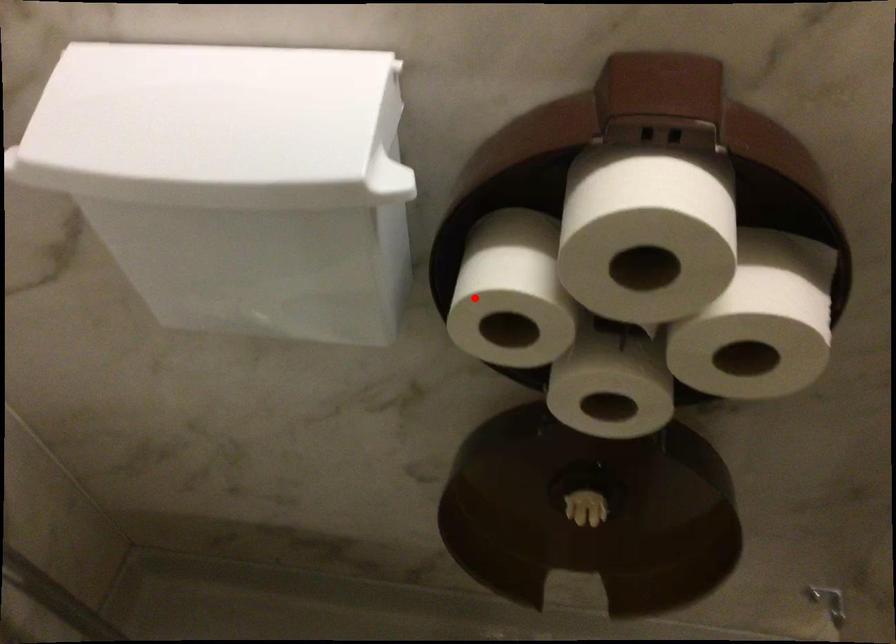
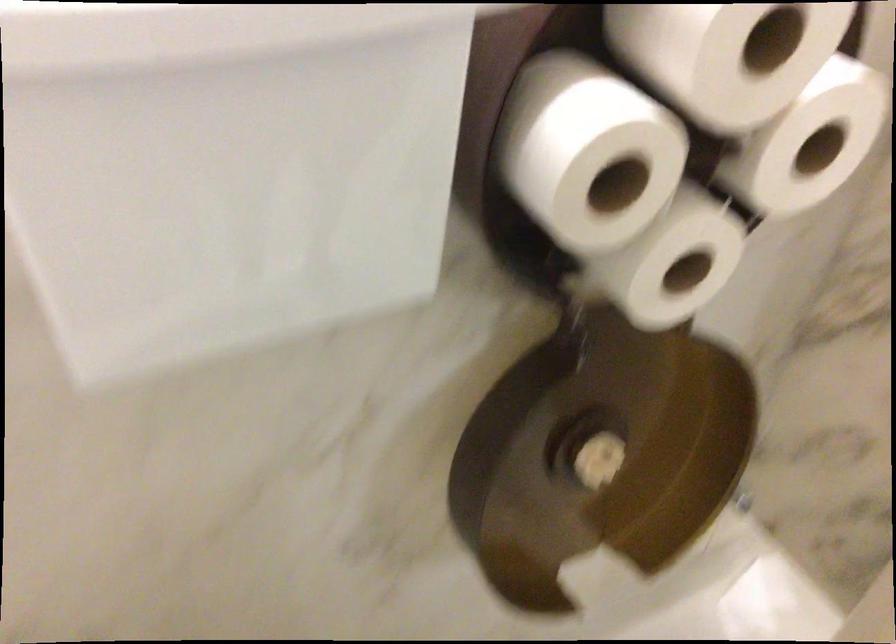
Where in the second image is the point corresponding to the highlighted location from the first image?

(584, 151)